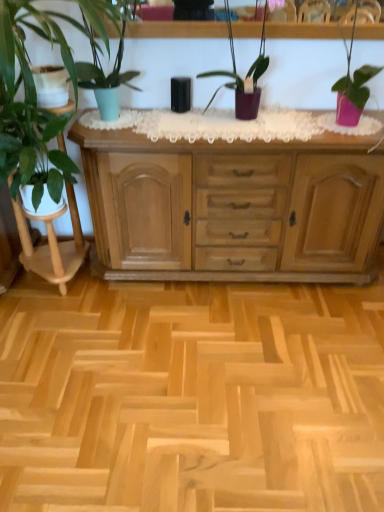
From the picture: In order to face white glossy plant stand at left, should I rotate leftwards or rightwards?

To align with it, rotate left about 18.939°.

Image resolution: width=384 pixels, height=512 pixels. What do you see at coordinates (53, 245) in the screenshot?
I see `white glossy plant stand at left` at bounding box center [53, 245].

In order to face matte green pot at left, marked as the first houseplant in a left-to-right arrangement, should I rotate leftwards or rightwards?

A 18.743 degree turn to the left will do.

The height and width of the screenshot is (512, 384). What do you see at coordinates (101, 64) in the screenshot?
I see `matte green pot at upper left, which appears as the second houseplant when viewed from the left` at bounding box center [101, 64].

In order to click on natural wood cabinet at center in this screenshot , I will do `click(233, 207)`.

Based on the photo, measure the distance between pink matte pot at right, the 1th houseplant viewed from the right, and camera.

pink matte pot at right, the 1th houseplant viewed from the right, and camera are 1.89 meters apart from each other.

Locate an element on the screen. The image size is (384, 512). pink matte pot at right, the 1th houseplant viewed from the right is located at coordinates (353, 87).

Identify the location of white glossy plant stand at left. The height and width of the screenshot is (512, 384). (53, 245).

Choose the correct answer: Is natural wood cabinet at center inside matte green pot at left, marked as the first houseplant in a left-to-right arrangement, or outside it?

natural wood cabinet at center is not inside matte green pot at left, marked as the first houseplant in a left-to-right arrangement, it's outside.

Where is `the chest of drawers below the matte green pot at left, the fourth houseplant from the right (from a real-world perspective)`? This screenshot has width=384, height=512. the chest of drawers below the matte green pot at left, the fourth houseplant from the right (from a real-world perspective) is located at coordinates (233, 207).

Based on the photo, how distant is natural wood cabinet at center from matte green pot at left, marked as the first houseplant in a left-to-right arrangement?

natural wood cabinet at center and matte green pot at left, marked as the first houseplant in a left-to-right arrangement, are 60.26 centimeters apart from each other.

Is natural wood cabinet at center looking in the opposite direction of matte green pot at left, marked as the first houseplant in a left-to-right arrangement?

natural wood cabinet at center does not have its back to matte green pot at left, marked as the first houseplant in a left-to-right arrangement.

From a real-world perspective, is purple matte plant at center, the 2th houseplant in the right-to-left sequence, below matte green pot at upper left, which appears as the 3th houseplant when viewed from the right?

Yes, from a real-world perspective, purple matte plant at center, the 2th houseplant in the right-to-left sequence, is below matte green pot at upper left, which appears as the 3th houseplant when viewed from the right.

Is matte green pot at upper left, which appears as the 3th houseplant when viewed from the right, inside purple matte plant at center, the third houseplant when ordered from left to right?

Actually, matte green pot at upper left, which appears as the 3th houseplant when viewed from the right, is outside purple matte plant at center, the third houseplant when ordered from left to right.

Is purple matte plant at center, the 2th houseplant in the right-to-left sequence, shorter than matte green pot at upper left, which appears as the 3th houseplant when viewed from the right?

Incorrect, the height of purple matte plant at center, the 2th houseplant in the right-to-left sequence, does not fall short of that of matte green pot at upper left, which appears as the 3th houseplant when viewed from the right.

Based on the photo, is purple matte plant at center, the third houseplant when ordered from left to right, taller than matte green pot at left, the fourth houseplant from the right?

Yes.

From a real-world perspective, which is physically below, purple matte plant at center, the third houseplant when ordered from left to right, or matte green pot at left, the fourth houseplant from the right?

purple matte plant at center, the third houseplant when ordered from left to right, is physically lower.

What's the angular difference between purple matte plant at center, the 2th houseplant in the right-to-left sequence, and matte green pot at left, the fourth houseplant from the right,'s facing directions?

purple matte plant at center, the 2th houseplant in the right-to-left sequence, and matte green pot at left, the fourth houseplant from the right, are facing 4.49 degrees away from each other.

Are purple matte plant at center, the third houseplant when ordered from left to right, and matte green pot at left, marked as the first houseplant in a left-to-right arrangement, far apart?

They are positioned close to each other.

Is purple matte plant at center, the 2th houseplant in the right-to-left sequence, looking in the opposite direction of pink matte pot at right, which is counted as the 4th houseplant, starting from the left?

No.

Who is bigger, purple matte plant at center, the 2th houseplant in the right-to-left sequence, or pink matte pot at right, which is counted as the 4th houseplant, starting from the left?

Bigger between the two is purple matte plant at center, the 2th houseplant in the right-to-left sequence.

From the image's perspective, relative to pink matte pot at right, the 1th houseplant viewed from the right, is purple matte plant at center, the third houseplant when ordered from left to right, above or below?

Clearly, from the image's perspective, purple matte plant at center, the third houseplant when ordered from left to right, is above pink matte pot at right, the 1th houseplant viewed from the right.

Is purple matte plant at center, the 2th houseplant in the right-to-left sequence, directly adjacent to pink matte pot at right, which is counted as the 4th houseplant, starting from the left?

purple matte plant at center, the 2th houseplant in the right-to-left sequence, and pink matte pot at right, which is counted as the 4th houseplant, starting from the left, are clearly separated.

Between white glossy plant stand at left and pink matte pot at right, the 1th houseplant viewed from the right, which one has less height?

With less height is pink matte pot at right, the 1th houseplant viewed from the right.

Considering the points (57, 261) and (357, 106), which point is in front, point (57, 261) or point (357, 106)?

The point (357, 106) is closer.

Considering the positions of objects white glossy plant stand at left and pink matte pot at right, which is counted as the 4th houseplant, starting from the left, in the image provided, who is more to the left, white glossy plant stand at left or pink matte pot at right, which is counted as the 4th houseplant, starting from the left,?

Positioned to the left is white glossy plant stand at left.

Would you say white glossy plant stand at left is a long distance from pink matte pot at right, which is counted as the 4th houseplant, starting from the left?

Yes, white glossy plant stand at left and pink matte pot at right, which is counted as the 4th houseplant, starting from the left, are located far from each other.

In terms of size, does white glossy plant stand at left appear bigger or smaller than matte green pot at upper left, which appears as the 3th houseplant when viewed from the right?

Clearly, white glossy plant stand at left is larger in size than matte green pot at upper left, which appears as the 3th houseplant when viewed from the right.

Which object is closer to the camera, white glossy plant stand at left or matte green pot at upper left, which appears as the 3th houseplant when viewed from the right?

Positioned in front is matte green pot at upper left, which appears as the 3th houseplant when viewed from the right.

Which is in front, point (21, 226) or point (81, 68)?

Point (81, 68)

Could matte green pot at upper left, which appears as the second houseplant when viewed from the left, be considered to be inside white glossy plant stand at left?

No, matte green pot at upper left, which appears as the second houseplant when viewed from the left, is not surrounded by white glossy plant stand at left.

From the image's perspective, is natural wood cabinet at center on top of purple matte plant at center, the third houseplant when ordered from left to right?

No.

Between natural wood cabinet at center and purple matte plant at center, the 2th houseplant in the right-to-left sequence, which one has smaller size?

purple matte plant at center, the 2th houseplant in the right-to-left sequence.

Is natural wood cabinet at center inside the boundaries of purple matte plant at center, the third houseplant when ordered from left to right, or outside?

natural wood cabinet at center lies outside purple matte plant at center, the third houseplant when ordered from left to right.

Which object is further away from the camera taking this photo, natural wood cabinet at center or purple matte plant at center, the third houseplant when ordered from left to right?

Positioned behind is natural wood cabinet at center.

At what (x,y) coordinates should I click in order to perform the action: click on houseplant that is the 3rd one when counting leftward from the natural wood cabinet at center. Please return your answer as a coordinate pair (x, y). Looking at the image, I should click on (35, 91).

Identify the location of the 1st houseplant to the right of the matte green pot at upper left, which appears as the 3th houseplant when viewed from the right, counting from the anchor's position. (245, 77).

Based on their spatial positions, is pink matte pot at right, the 1th houseplant viewed from the right, or matte green pot at upper left, which appears as the second houseplant when viewed from the left, further from matte green pot at left, marked as the first houseplant in a left-to-right arrangement?

The object further to matte green pot at left, marked as the first houseplant in a left-to-right arrangement, is pink matte pot at right, the 1th houseplant viewed from the right.

When comparing their distances from white glossy plant stand at left, does matte green pot at left, marked as the first houseplant in a left-to-right arrangement, or natural wood cabinet at center seem closer?

Among the two, matte green pot at left, marked as the first houseplant in a left-to-right arrangement, is located nearer to white glossy plant stand at left.

Based on their spatial positions, is purple matte plant at center, the third houseplant when ordered from left to right, or matte green pot at left, marked as the first houseplant in a left-to-right arrangement, closer to white glossy plant stand at left?

The object closer to white glossy plant stand at left is matte green pot at left, marked as the first houseplant in a left-to-right arrangement.

Considering their positions, is purple matte plant at center, the third houseplant when ordered from left to right, positioned further to white glossy plant stand at left than natural wood cabinet at center?

Based on the image, purple matte plant at center, the third houseplant when ordered from left to right, appears to be further to white glossy plant stand at left.

Which object lies nearer to the anchor point matte green pot at upper left, which appears as the 3th houseplant when viewed from the right, pink matte pot at right, which is counted as the 4th houseplant, starting from the left, or matte green pot at left, the fourth houseplant from the right?

matte green pot at left, the fourth houseplant from the right, lies closer to matte green pot at upper left, which appears as the 3th houseplant when viewed from the right, than the other object.

Looking at this image, estimate the real-world distances between objects in this image. Which object is closer to purple matte plant at center, the 2th houseplant in the right-to-left sequence, pink matte pot at right, the 1th houseplant viewed from the right, or white glossy plant stand at left?

pink matte pot at right, the 1th houseplant viewed from the right, is positioned closer to the anchor purple matte plant at center, the 2th houseplant in the right-to-left sequence.

Looking at the image, which one is located further to purple matte plant at center, the 2th houseplant in the right-to-left sequence, natural wood cabinet at center or white glossy plant stand at left?

Among the two, white glossy plant stand at left is located further to purple matte plant at center, the 2th houseplant in the right-to-left sequence.

When comparing their distances from matte green pot at left, the fourth houseplant from the right, does white glossy plant stand at left or pink matte pot at right, which is counted as the 4th houseplant, starting from the left, seem closer?

white glossy plant stand at left lies closer to matte green pot at left, the fourth houseplant from the right, than the other object.

Image resolution: width=384 pixels, height=512 pixels. I want to click on houseplant situated between matte green pot at upper left, which appears as the second houseplant when viewed from the left, and pink matte pot at right, which is counted as the 4th houseplant, starting from the left, from left to right, so click(245, 77).

The height and width of the screenshot is (512, 384). Identify the location of the chest of drawers located between matte green pot at left, marked as the first houseplant in a left-to-right arrangement, and pink matte pot at right, which is counted as the 4th houseplant, starting from the left, in the left-right direction. (233, 207).

The height and width of the screenshot is (512, 384). What are the coordinates of `houseplant located between matte green pot at left, the fourth houseplant from the right, and purple matte plant at center, the third houseplant when ordered from left to right, in the left-right direction` in the screenshot? It's located at (101, 64).

This screenshot has width=384, height=512. I want to click on chest of drawers between matte green pot at upper left, which appears as the 3th houseplant when viewed from the right, and pink matte pot at right, which is counted as the 4th houseplant, starting from the left, so click(x=233, y=207).